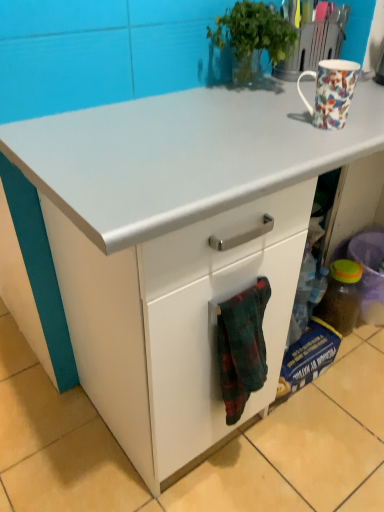
Locate an element on the screen. vacant region under green leafy plant at upper center (from a real-world perspective) is located at coordinates (254, 94).